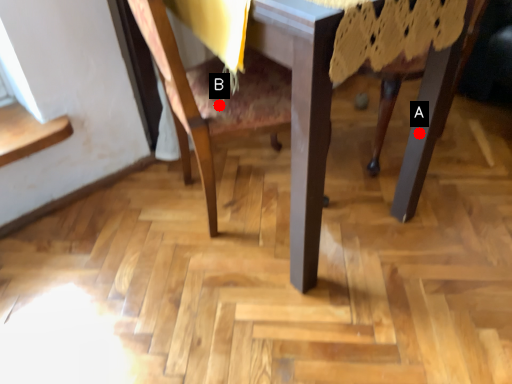
Question: Two points are circled on the image, labeled by A and B beside each circle. Which point is further to the camera?

Choices:
 (A) A is further
 (B) B is further

Answer: (A)